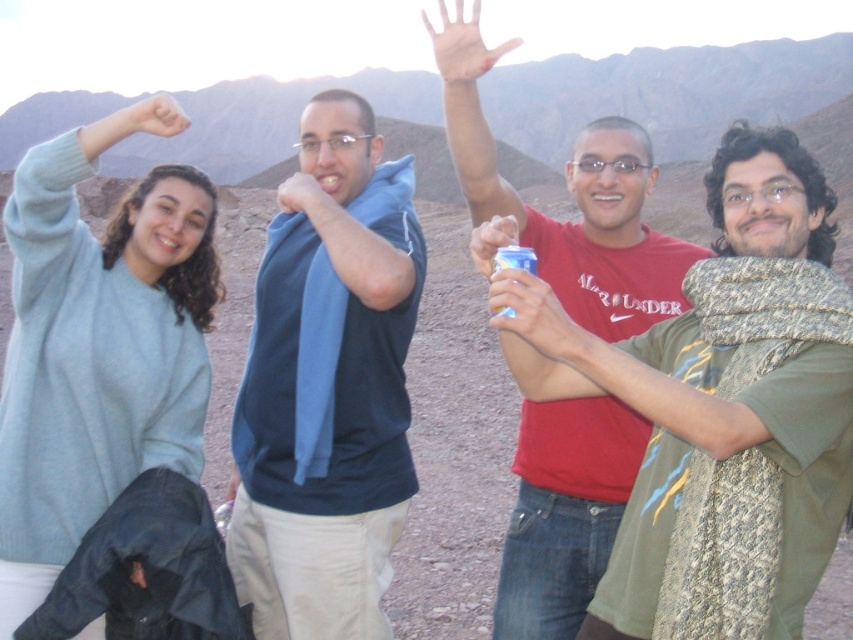
Between matte red shirt at center and matte skin at upper left, which one appears on the left side from the viewer's perspective?

matte skin at upper left

Is point (577, 268) positioned in front of point (149, 132)?

No, it is not.

Locate an element on the screen. The width and height of the screenshot is (853, 640). matte red shirt at center is located at coordinates [582, 220].

Who is positioned more to the right, dark blue fabric at center or blue metallic can at center?

blue metallic can at center

Can you confirm if dark blue fabric at center is positioned to the right of blue metallic can at center?

In fact, dark blue fabric at center is to the left of blue metallic can at center.

Does point (392, 342) come farther from viewer compared to point (552, 339)?

That is True.

You are a GUI agent. You are given a task and a screenshot of the screen. Output one action in this format:
    pyautogui.click(x=<x>, y=<y>)
    Task: Click on the dark blue fabric at center
    
    Given the screenshot: What is the action you would take?
    pyautogui.click(x=328, y=392)

Is matte red t-shirt at center smaller than white matte hand at upper center?

Yes.

Does point (685, 516) come behind point (500, 45)?

No, (685, 516) is closer to viewer.

Is point (834, 428) more distant than point (508, 40)?

No, (834, 428) is closer to viewer.

Identify the location of matte red t-shirt at center. The height and width of the screenshot is (640, 853). (730, 413).